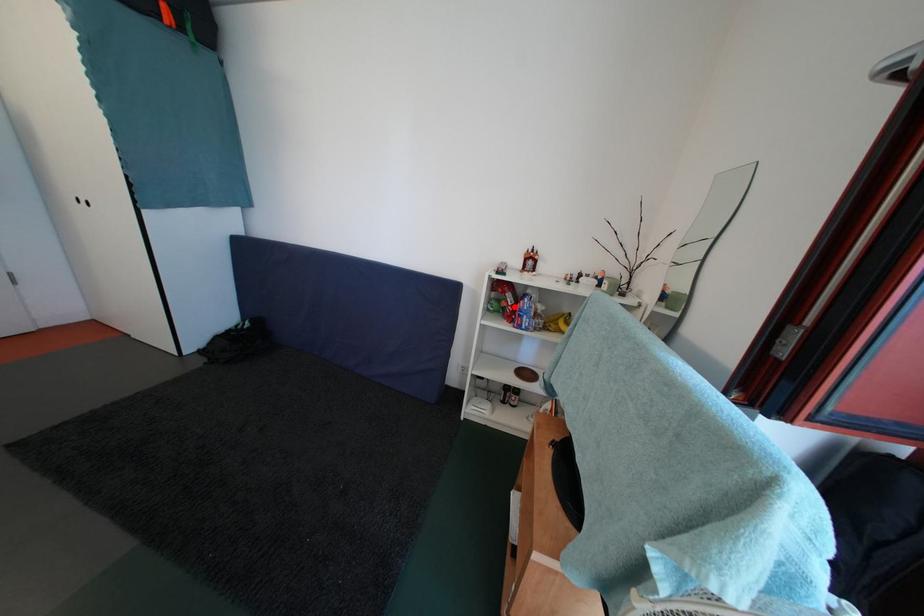
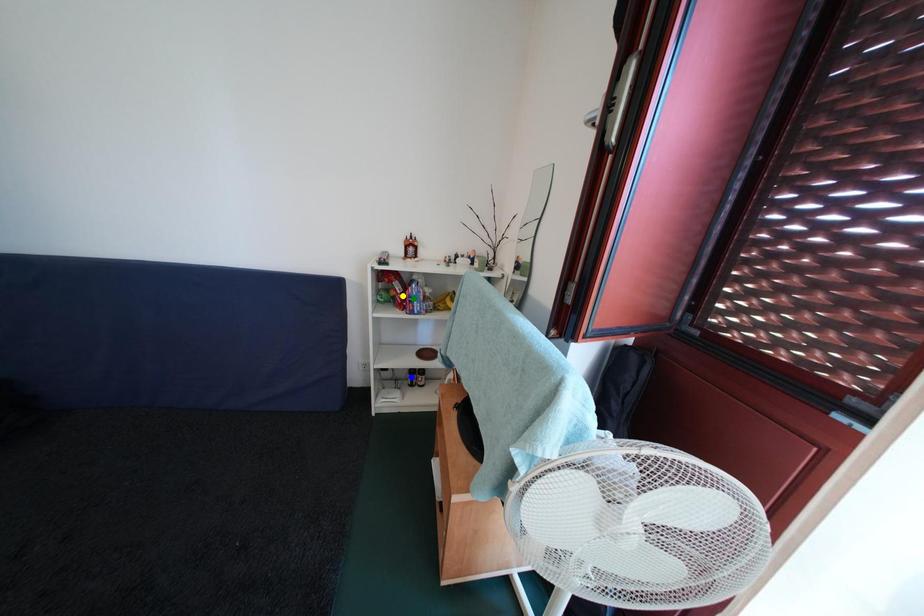
Question: I am providing you with two images of the same scene from different viewpoints. A red point is marked on the first image. You are given multiple points on the second image. Can you choose the point in image 2 that corresponds to the point in image 1?

Choices:
 (A) blue point
 (B) green point
 (C) yellow point

Answer: (C)